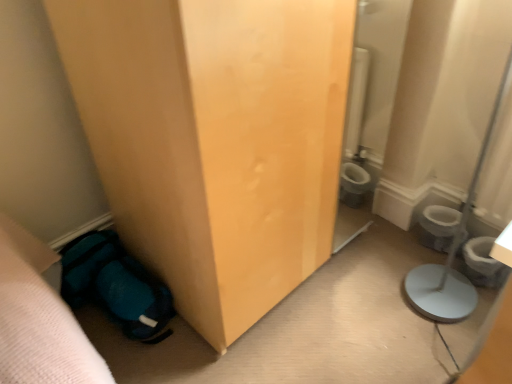
Question: Is teal fabric sleeping bag at lower left oriented towards white glossy toilet bowl at lower right?

Choices:
 (A) no
 (B) yes

Answer: (A)

Question: Is teal fabric sleeping bag at lower left positioned behind white glossy toilet bowl at lower right?

Choices:
 (A) yes
 (B) no

Answer: (B)

Question: Can you confirm if teal fabric sleeping bag at lower left is taller than white glossy toilet bowl at lower right?

Choices:
 (A) yes
 (B) no

Answer: (B)

Question: Does teal fabric sleeping bag at lower left lie in front of white glossy toilet bowl at lower right?

Choices:
 (A) no
 (B) yes

Answer: (B)

Question: Is teal fabric sleeping bag at lower left at the right side of white glossy toilet bowl at lower right?

Choices:
 (A) yes
 (B) no

Answer: (B)

Question: Are teal fabric sleeping bag at lower left and white glossy toilet bowl at lower right far apart?

Choices:
 (A) no
 (B) yes

Answer: (B)

Question: Does white glossy toilet bowl at lower right have a larger size compared to teal fabric sleeping bag at lower left?

Choices:
 (A) yes
 (B) no

Answer: (B)

Question: Is white glossy toilet bowl at lower right aimed at teal fabric sleeping bag at lower left?

Choices:
 (A) no
 (B) yes

Answer: (A)

Question: Can you confirm if white glossy toilet bowl at lower right is shorter than teal fabric sleeping bag at lower left?

Choices:
 (A) no
 (B) yes

Answer: (A)

Question: Is white glossy toilet bowl at lower right positioned with its back to teal fabric sleeping bag at lower left?

Choices:
 (A) yes
 (B) no

Answer: (B)

Question: Can you confirm if white glossy toilet bowl at lower right is taller than teal fabric sleeping bag at lower left?

Choices:
 (A) no
 (B) yes

Answer: (B)

Question: Does white glossy toilet bowl at lower right have a smaller size compared to teal fabric sleeping bag at lower left?

Choices:
 (A) yes
 (B) no

Answer: (A)

Question: Is white glossy toilet bowl at lower right looking in the opposite direction of white plastic potty at lower right?

Choices:
 (A) yes
 (B) no

Answer: (A)